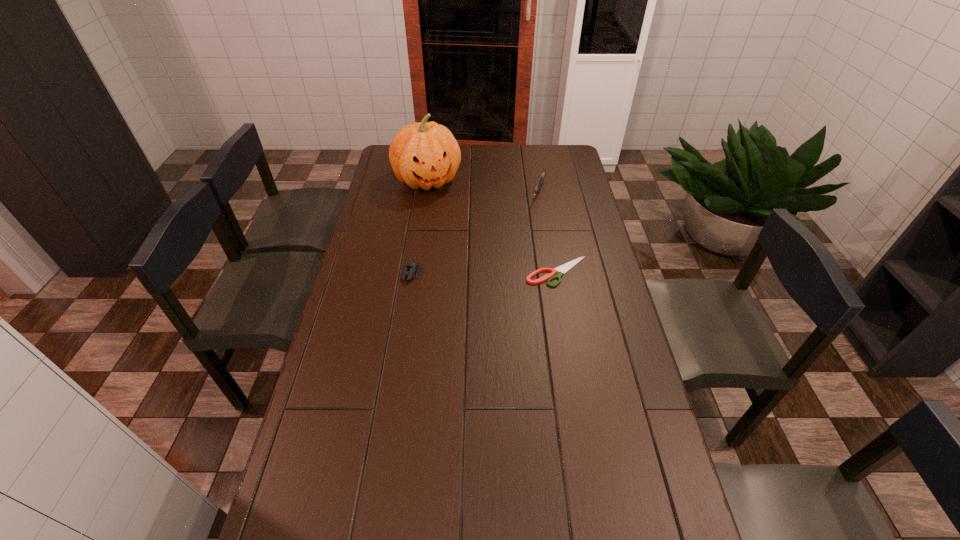
Where is `free space on the desktop that is between the second shortest object and the scissors and is positioned on the carved face of the pumpkin`? This screenshot has height=540, width=960. free space on the desktop that is between the second shortest object and the scissors and is positioned on the carved face of the pumpkin is located at coordinates (468, 273).

At what (x,y) coordinates should I click in order to perform the action: click on vacant space on the desktop that is between the computer mouse and the shortest object and is positioned aimed along the barrel of the third shortest object. Please return your answer as a coordinate pair (x, y). The height and width of the screenshot is (540, 960). Looking at the image, I should click on (506, 273).